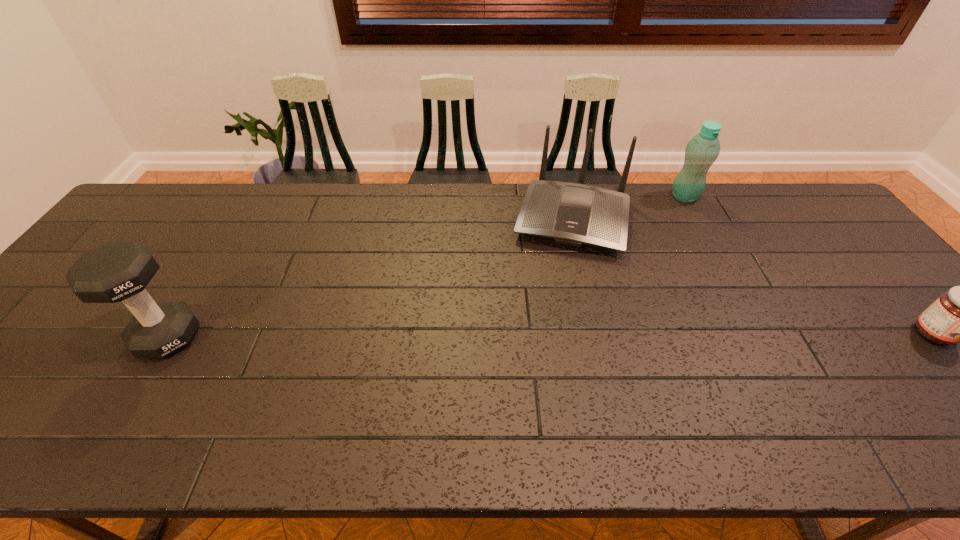
Where is `free space on the desktop that is between the dumbbell and the shortest object and is positioned on the front-facing side of the router`? free space on the desktop that is between the dumbbell and the shortest object and is positioned on the front-facing side of the router is located at coordinates (547, 335).

Identify the location of free space on the desktop that is between the leftmost object and the shortest object and is positioned at the front cap of the second object from right to left. This screenshot has height=540, width=960. (664, 335).